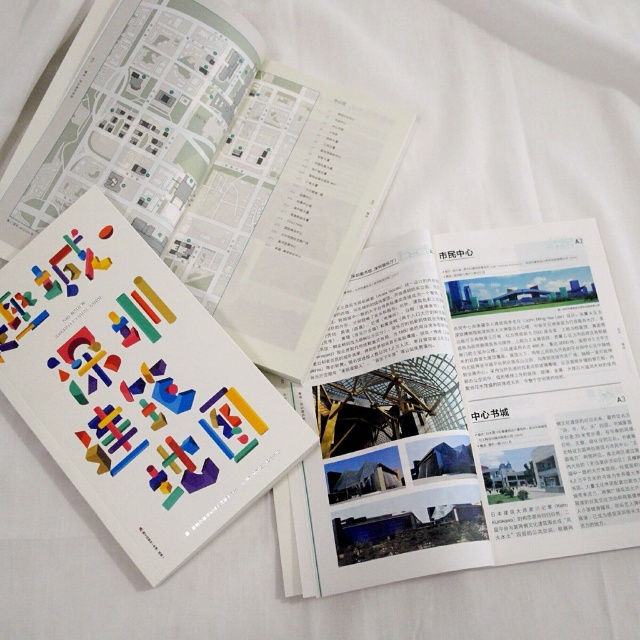
Question: Which point is closer to the camera taking this photo?

Choices:
 (A) (250, 218)
 (B) (243, 372)

Answer: (B)

Question: Can you confirm if white paper at upper center is thinner than multicolored plastic book at center?

Choices:
 (A) yes
 (B) no

Answer: (A)

Question: Which object appears closest to the camera in this image?

Choices:
 (A) colorful paper cutouts at center
 (B) white paper at upper center
 (C) multicolored plastic book at center

Answer: (B)

Question: Among these objects, which one is farthest from the camera?

Choices:
 (A) multicolored plastic book at center
 (B) colorful paper cutouts at center

Answer: (A)

Question: Where is multicolored plastic book at center located in relation to colorful paper cutouts at center in the image?

Choices:
 (A) above
 (B) below

Answer: (A)

Question: Does multicolored plastic book at center have a larger size compared to colorful paper cutouts at center?

Choices:
 (A) no
 (B) yes

Answer: (B)